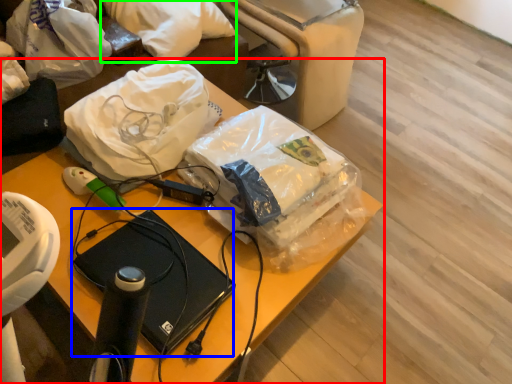
Question: Which is farther away from furniture (highlighted by a red box)? computer (highlighted by a blue box) or pillow (highlighted by a green box)?

Choices:
 (A) computer
 (B) pillow

Answer: (B)